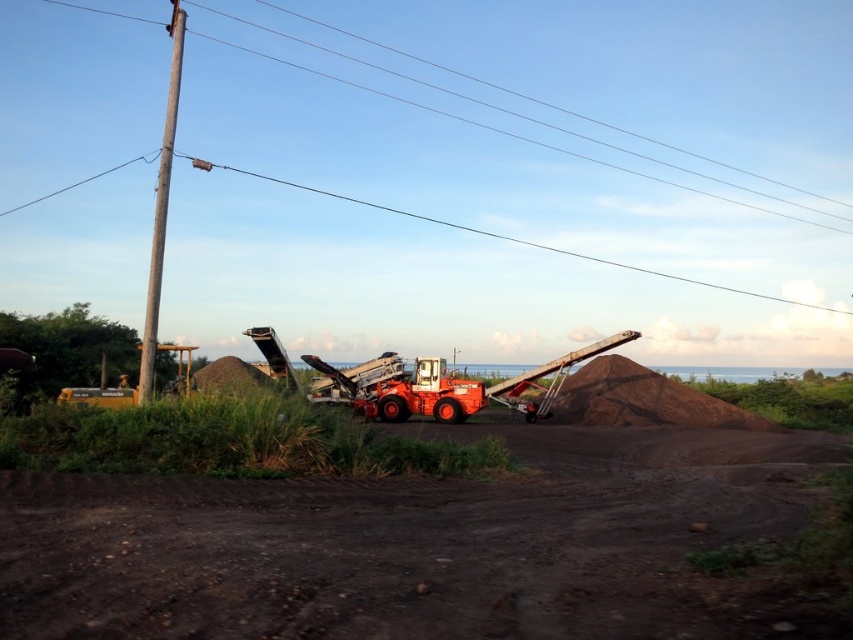
Question: Can you confirm if dirt track at center is positioned to the left of brown wooden telegraph pole at left?

Choices:
 (A) yes
 (B) no

Answer: (B)

Question: Is dirt track at center below brown wooden telegraph pole at left?

Choices:
 (A) no
 (B) yes

Answer: (B)

Question: Can you confirm if dirt track at center is positioned to the right of brown wooden telegraph pole at left?

Choices:
 (A) no
 (B) yes

Answer: (B)

Question: Which point appears closest to the camera in this image?

Choices:
 (A) (171, 52)
 (B) (703, 582)

Answer: (B)

Question: Among these objects, which one is farthest from the camera?

Choices:
 (A) brown wooden telegraph pole at left
 (B) dirt track at center

Answer: (A)